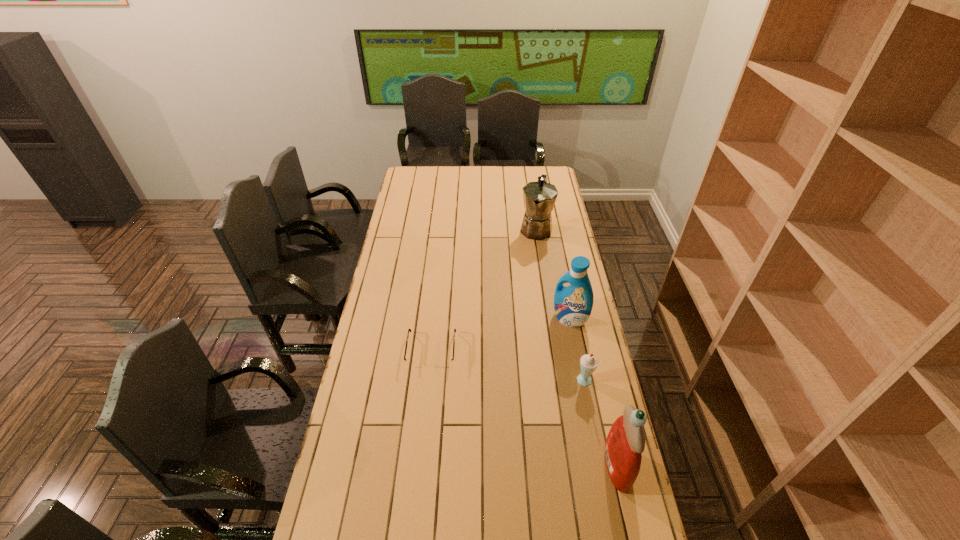
This screenshot has width=960, height=540. What are the coordinates of `free area in between the nearest object and the farthest object` in the screenshot? It's located at (576, 347).

This screenshot has height=540, width=960. Find the location of `vacant space that's between the farthest object and the spectacles`. vacant space that's between the farthest object and the spectacles is located at coordinates (484, 289).

Choose which object is the nearest neighbor to the coffeepot. Please provide its 2D coordinates. Your answer should be formatted as a tuple, i.e. [(x, y)], where the tuple contains the x and y coordinates of a point satisfying the conditions above.

[(573, 304)]

Identify which object is the closest to the nearest object. Please provide its 2D coordinates. Your answer should be formatted as a tuple, i.e. [(x, y)], where the tuple contains the x and y coordinates of a point satisfying the conditions above.

[(588, 363)]

Locate an element on the screen. This screenshot has width=960, height=540. vacant space that satisfies the following two spatial constraints: 1. at the hinge ends of the third nearest object; 2. on the left side of the second shortest object is located at coordinates (428, 381).

You are a GUI agent. You are given a task and a screenshot of the screen. Output one action in this format:
    pyautogui.click(x=<x>, y=<y>)
    Task: Click on the free spot that satisfies the following two spatial constraints: 1. on the front side of the coffeepot; 2. on the left side of the fourth tallest object
    This screenshot has width=960, height=540.
    Given the screenshot: What is the action you would take?
    pyautogui.click(x=560, y=381)

Where is `vacant space that satisfies the following two spatial constraints: 1. at the hinge ends of the shortest object; 2. on the front surface of the nearest object`? The image size is (960, 540). vacant space that satisfies the following two spatial constraints: 1. at the hinge ends of the shortest object; 2. on the front surface of the nearest object is located at coordinates (420, 466).

The image size is (960, 540). Find the location of `blank area in the image that satisfies the following two spatial constraints: 1. at the hinge ends of the nearer detergent; 2. on the front surface of the spectacles`. blank area in the image that satisfies the following two spatial constraints: 1. at the hinge ends of the nearer detergent; 2. on the front surface of the spectacles is located at coordinates (420, 466).

Where is `vacant space that satisfies the following two spatial constraints: 1. on the front side of the fourth tallest object; 2. on the right side of the farther detergent`? vacant space that satisfies the following two spatial constraints: 1. on the front side of the fourth tallest object; 2. on the right side of the farther detergent is located at coordinates (582, 381).